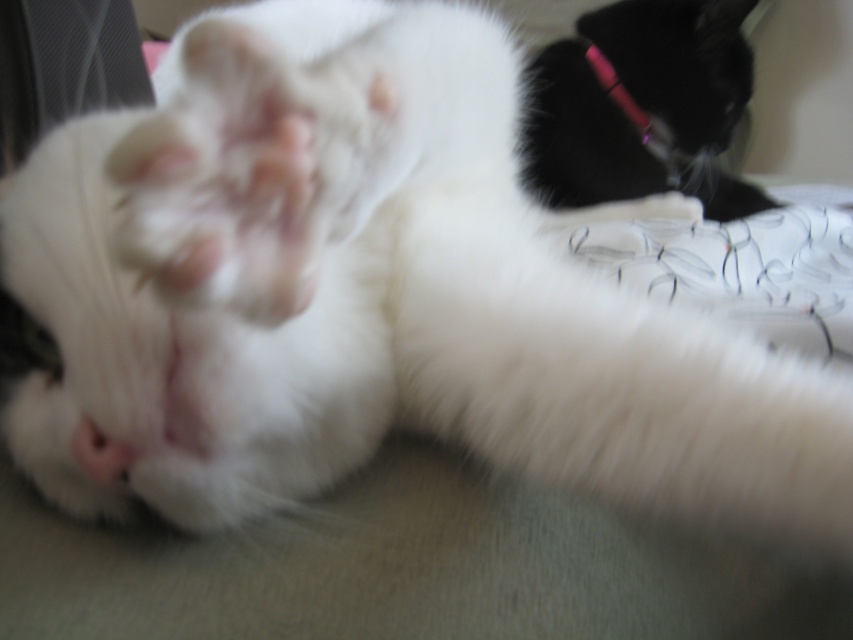
You are a photographer trying to capture both the black fur cat at upper right and the pink plastic pen at upper right in a single frame. Which object should you adjust your camera angle to focus on first if you want to ensure both are in the frame without cropping?

The black fur cat at upper right is wider than the pink plastic pen at upper right, so you should focus on including the black fur cat at upper right first to ensure the pink plastic pen at upper right also fits in the frame.

You are a photographer trying to capture the black fur cat at upper right without any obstructions. The pink plastic pen at upper right is blocking the view. Can you move the pen to the side to get a clear shot?

The black fur cat at upper right is positioned under the pink plastic pen at upper right, so moving the pen to the side would allow an unobstructed view of the cat.